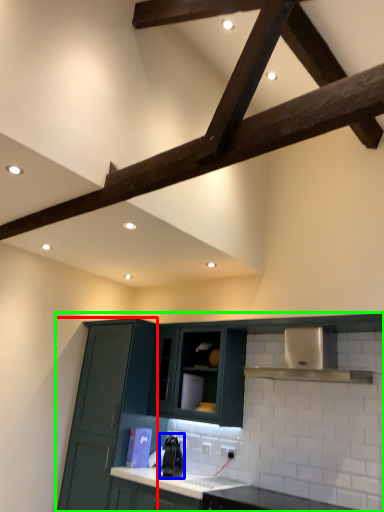
Question: Considering the real-world distances, which object is closest to cabinetry (highlighted by a red box)? appliance (highlighted by a blue box) or cabinetry (highlighted by a green box).

Choices:
 (A) appliance
 (B) cabinetry

Answer: (B)